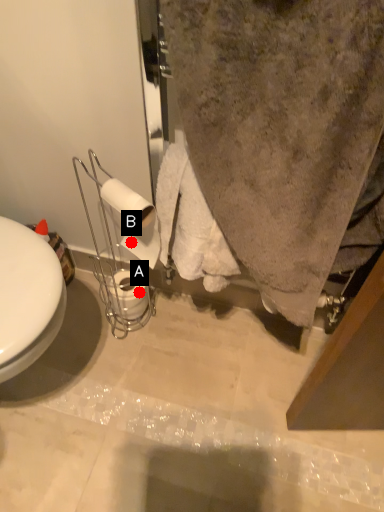
Question: Two points are circled on the image, labeled by A and B beside each circle. Which of the following is the closest to the observer?

Choices:
 (A) A is closer
 (B) B is closer

Answer: (B)